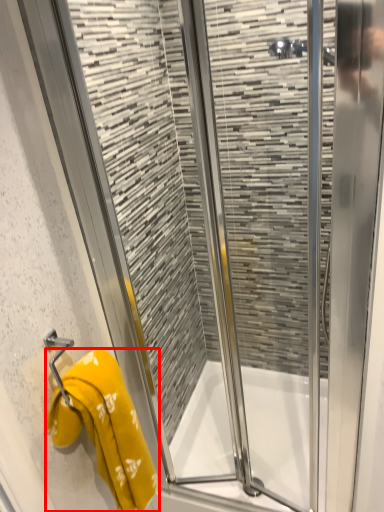
Question: From the image, what is the correct spatial relationship of towel (annotated by the red box) in relation to bath?

Choices:
 (A) right
 (B) left

Answer: (B)